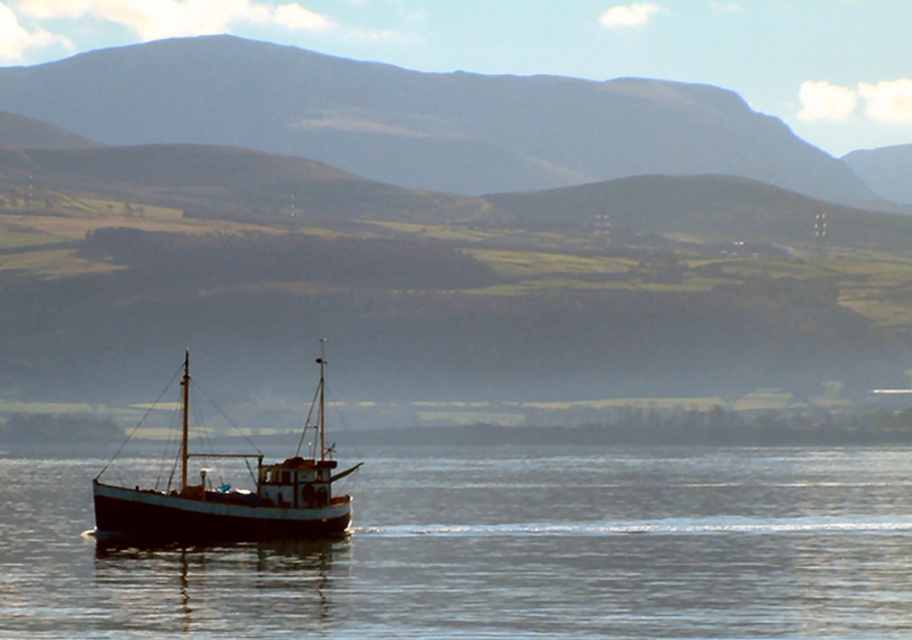
Can you confirm if smooth water at center is positioned below gray rocky mountain at upper center?

Indeed, smooth water at center is positioned under gray rocky mountain at upper center.

In the scene shown: Is smooth water at center to the right of gray rocky mountain at upper center from the viewer's perspective?

No, smooth water at center is not to the right of gray rocky mountain at upper center.

Who is more forward, (672, 625) or (102, 134)?

→ Positioned in front is point (672, 625).

Locate an element on the screen. This screenshot has height=640, width=912. smooth water at center is located at coordinates (500, 552).

Describe the element at coordinates (421, 120) in the screenshot. This screenshot has height=640, width=912. I see `gray rocky mountain at upper center` at that location.

Which of these two, gray rocky mountain at upper center or white matte boat at lower left, stands shorter?

white matte boat at lower left is shorter.

What do you see at coordinates (421, 120) in the screenshot?
I see `gray rocky mountain at upper center` at bounding box center [421, 120].

Image resolution: width=912 pixels, height=640 pixels. In order to click on gray rocky mountain at upper center in this screenshot , I will do `click(421, 120)`.

Does point (753, 508) come behind point (345, 497)?

Yes, it is.

Does smooth water at center have a larger size compared to white matte boat at lower left?

Incorrect, smooth water at center is not larger than white matte boat at lower left.

What do you see at coordinates (500, 552) in the screenshot? I see `smooth water at center` at bounding box center [500, 552].

I want to click on smooth water at center, so click(x=500, y=552).